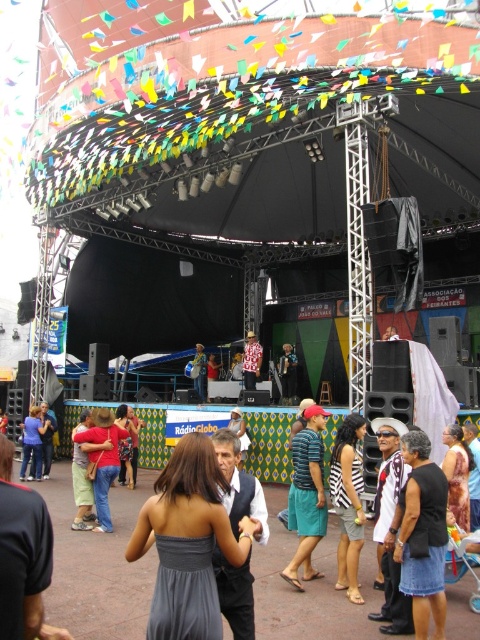
Is matte gray dress at center wider than matte black shirt at center?

Yes, matte gray dress at center is wider than matte black shirt at center.

Is matte gray dress at center shorter than matte black shirt at center?

No, matte gray dress at center is not shorter than matte black shirt at center.

Image resolution: width=480 pixels, height=640 pixels. I want to click on matte gray dress at center, so click(101, 460).

Does white printed shirt at center appear on the right side of brown textured dress at lower right?

In fact, white printed shirt at center is to the left of brown textured dress at lower right.

Can you confirm if white printed shirt at center is shorter than brown textured dress at lower right?

Incorrect, white printed shirt at center's height does not fall short of brown textured dress at lower right's.

Does point (394, 589) come farther from viewer compared to point (462, 442)?

No, (394, 589) is in front of (462, 442).

Where is `white printed shirt at center`? Image resolution: width=480 pixels, height=640 pixels. white printed shirt at center is located at coordinates (389, 525).

Which of these two, dark gray fabric dress at center or striped fabric dress at center, stands shorter?

With less height is dark gray fabric dress at center.

Who is more forward, (412, 476) or (348, 477)?

Point (412, 476) is more forward.

The image size is (480, 640). What do you see at coordinates (422, 536) in the screenshot? I see `dark gray fabric dress at center` at bounding box center [422, 536].

Locate an element on the screen. The height and width of the screenshot is (640, 480). dark gray fabric dress at center is located at coordinates (422, 536).